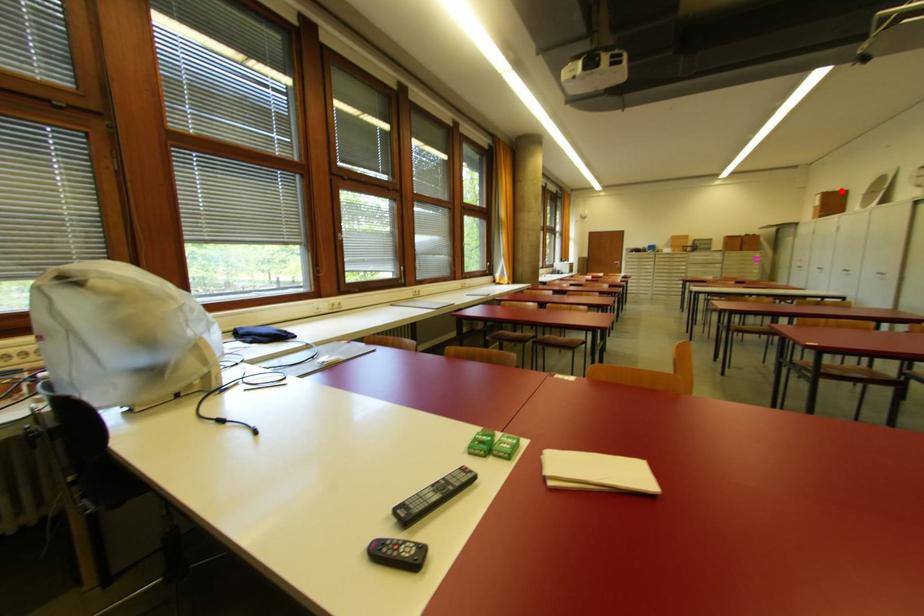
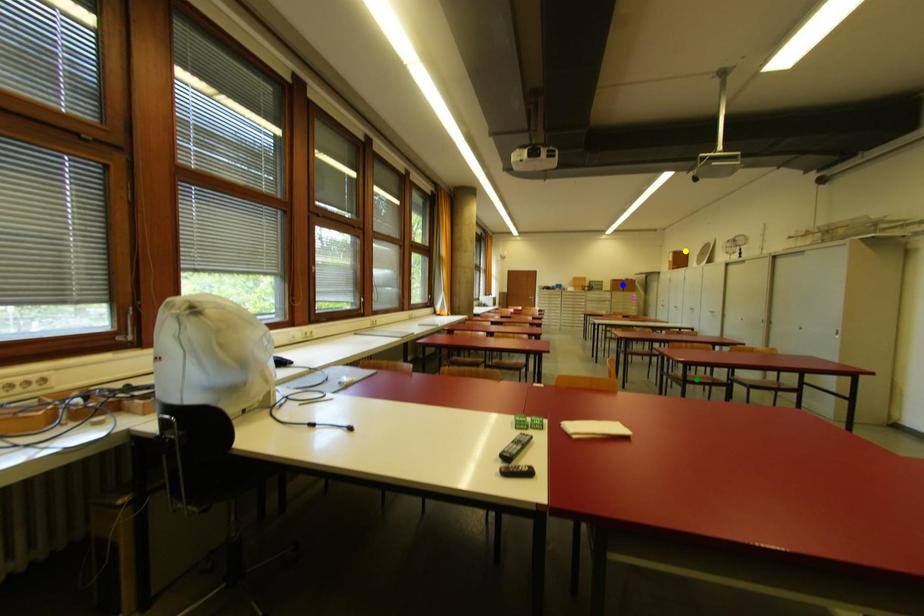
Question: I am providing you with two images of the same scene from different viewpoints. A red point is marked on the first image. You are given multiple points on the second image. Can you choose the point in image 2 that corresponds to the point in image 1?

Choices:
 (A) blue point
 (B) yellow point
 (C) green point

Answer: (B)